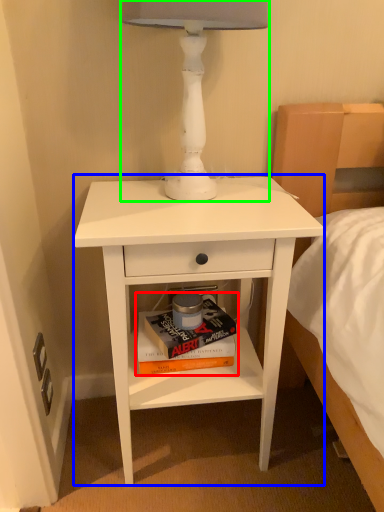
Question: Estimate the real-world distances between objects in this image. Which object is closer to paperback book (highlighted by a red box), nightstand (highlighted by a blue box) or table lamp (highlighted by a green box)?

Choices:
 (A) nightstand
 (B) table lamp

Answer: (A)